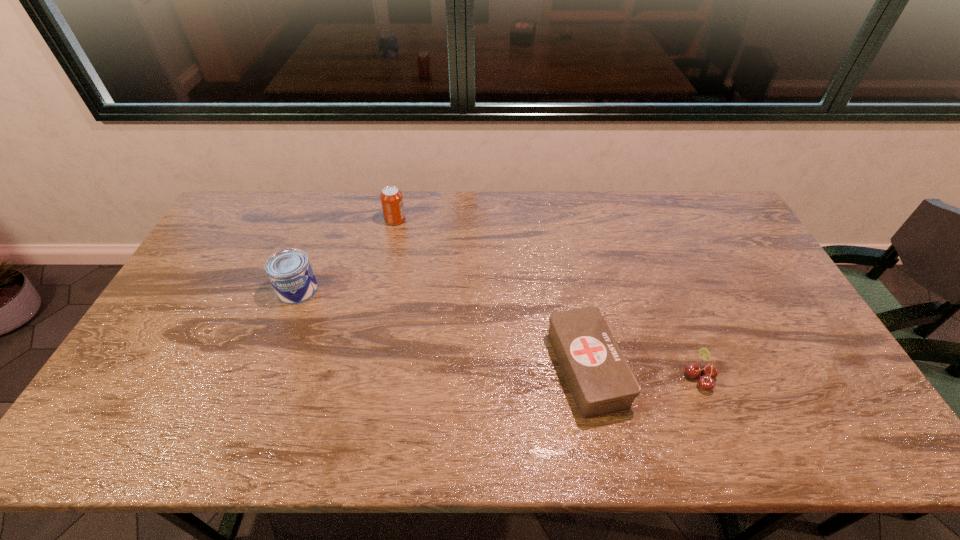
You are a GUI agent. You are given a task and a screenshot of the screen. Output one action in this format:
    pyautogui.click(x=<x>, y=<y>)
    Task: Click on the free area in between the second object from right to left and the farther can
    
    Given the screenshot: What is the action you would take?
    pyautogui.click(x=491, y=294)

This screenshot has width=960, height=540. Identify the location of empty space that is in between the second object from left to right and the leftmost object. (347, 255).

In order to click on free space between the rightmost object and the farther can in this screenshot , I will do `click(547, 298)`.

Find the location of a particular element. unoccupied position between the left can and the third object from left to right is located at coordinates (443, 329).

Find the location of a particular element. free space that is in between the cherry and the first-aid kit is located at coordinates (643, 373).

At what (x,y) coordinates should I click in order to perform the action: click on vacant region between the rightmost object and the second object from left to right. Please return your answer as a coordinate pair (x, y). This screenshot has height=540, width=960. Looking at the image, I should click on (547, 298).

Where is `unoccupied position between the second object from left to right and the first-aid kit`? unoccupied position between the second object from left to right and the first-aid kit is located at coordinates (491, 294).

Identify which object is the third nearest to the cherry. Please provide its 2D coordinates. Your answer should be formatted as a tuple, i.e. [(x, y)], where the tuple contains the x and y coordinates of a point satisfying the conditions above.

[(289, 271)]

Choose which object is the second nearest neighbor to the farthest object. Please provide its 2D coordinates. Your answer should be formatted as a tuple, i.e. [(x, y)], where the tuple contains the x and y coordinates of a point satisfying the conditions above.

[(601, 382)]

Locate an element on the screen. The height and width of the screenshot is (540, 960). vacant space that satisfies the following two spatial constraints: 1. on the front side of the right can; 2. on the right side of the first-aid kit is located at coordinates (364, 369).